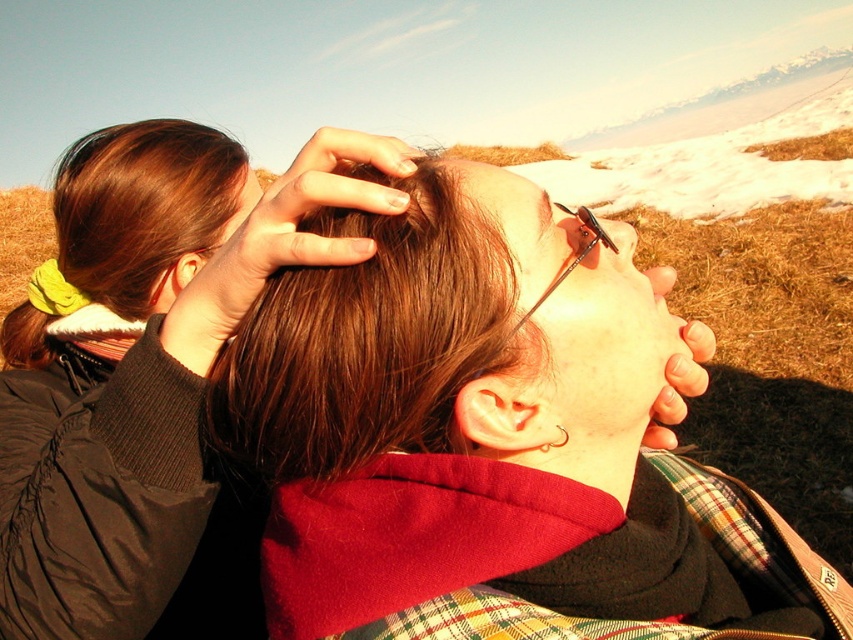
You are standing in the scene and see the point marked at coordinates (x=460, y=422). What object is located at that point?

The point at coordinates (x=460, y=422) marks the location of the matte red fleece at center.

You are a photographer trying to capture the scene between the two people. You notice two strands of hair, the brown shiny hair at center and the smooth brown hair at center. Which strand of hair is taller?

The brown shiny hair at center is taller than the smooth brown hair at center.

You are a photographer trying to capture the scene between the matte black jacket at upper left and the smooth brown hair at center. To ensure both are in frame, which direction should you move your camera? Please explain your reasoning based on their positions.

The matte black jacket at upper left is to the left of the smooth brown hair at center, so moving the camera slightly to the left would keep both objects in frame while maintaining their relative positions.